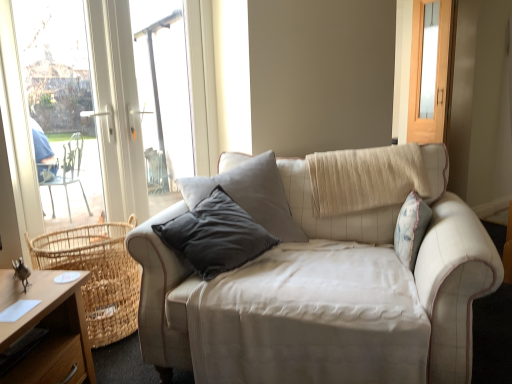
Question: From a real-world perspective, is woven natural basket at lower left positioned under beige fabric couch at center based on gravity?

Choices:
 (A) yes
 (B) no

Answer: (A)

Question: Is woven natural basket at lower left facing away from beige fabric couch at center?

Choices:
 (A) no
 (B) yes

Answer: (A)

Question: Is woven natural basket at lower left at the right side of beige fabric couch at center?

Choices:
 (A) no
 (B) yes

Answer: (A)

Question: Is woven natural basket at lower left next to beige fabric couch at center?

Choices:
 (A) no
 (B) yes

Answer: (A)

Question: Is woven natural basket at lower left wider than beige fabric couch at center?

Choices:
 (A) yes
 (B) no

Answer: (B)

Question: Is woven natural basket at lower left shorter than beige fabric couch at center?

Choices:
 (A) no
 (B) yes

Answer: (B)

Question: Can you confirm if beige fabric couch at center is smaller than matte wooden screen door at upper right?

Choices:
 (A) yes
 (B) no

Answer: (B)

Question: Does beige fabric couch at center have a greater height compared to matte wooden screen door at upper right?

Choices:
 (A) no
 (B) yes

Answer: (A)

Question: Considering the relative sizes of beige fabric couch at center and matte wooden screen door at upper right in the image provided, is beige fabric couch at center wider than matte wooden screen door at upper right?

Choices:
 (A) yes
 (B) no

Answer: (A)

Question: Is beige fabric couch at center positioned beyond the bounds of matte wooden screen door at upper right?

Choices:
 (A) no
 (B) yes

Answer: (B)

Question: Can you see beige fabric couch at center touching matte wooden screen door at upper right?

Choices:
 (A) no
 (B) yes

Answer: (A)

Question: From a real-world perspective, does beige fabric couch at center sit lower than matte wooden screen door at upper right?

Choices:
 (A) no
 (B) yes

Answer: (B)

Question: From the image's perspective, is matte wooden screen door at upper right below woven natural basket at lower left?

Choices:
 (A) no
 (B) yes

Answer: (A)